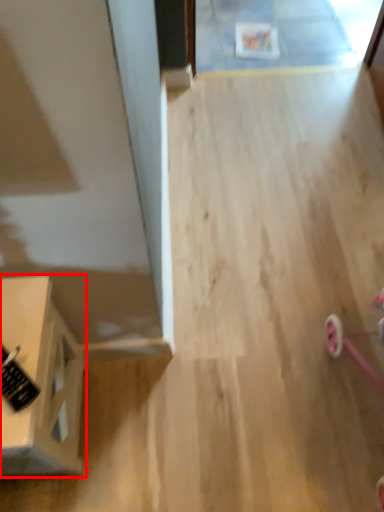
Question: Considering the relative positions of furniture (annotated by the red box) and control in the image provided, where is furniture (annotated by the red box) located with respect to the staircase?

Choices:
 (A) right
 (B) left

Answer: (B)